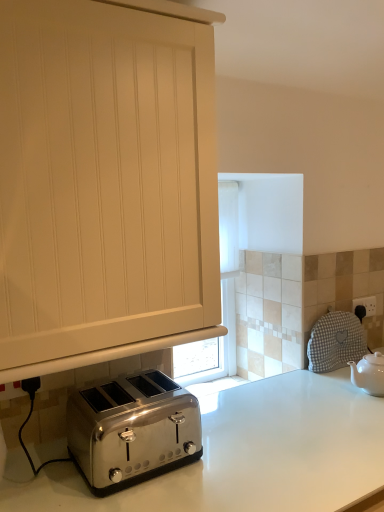
Identify the location of empty space that is ontop of white glossy countertop at lower center (from a real-world perspective). This screenshot has height=512, width=384. (280, 432).